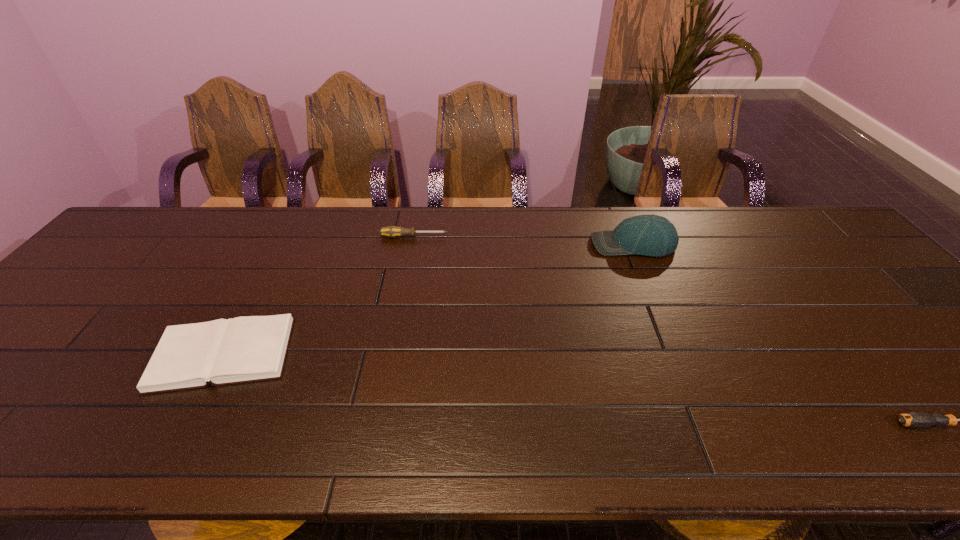
Identify the location of screwdriver that is at the far edge. This screenshot has width=960, height=540. (391, 231).

Identify the location of vacant space at the far edge of the desktop. (601, 225).

In the image, there is a desktop. At what (x,y) coordinates should I click in order to perform the action: click on blank space at the near edge. Please return your answer as a coordinate pair (x, y). This screenshot has width=960, height=540. Looking at the image, I should click on (348, 447).

The height and width of the screenshot is (540, 960). Identify the location of vacant space at the left edge of the desktop. (41, 392).

Image resolution: width=960 pixels, height=540 pixels. Identify the location of free space at the right edge of the desktop. (879, 302).

What are the coordinates of `blank area at the far left corner` in the screenshot? It's located at (172, 210).

Where is `vacant position at the far right corner of the desktop`? vacant position at the far right corner of the desktop is located at coordinates (784, 218).

Locate an element on the screen. free point between the leftmost object and the left screwdriver is located at coordinates (319, 295).

This screenshot has width=960, height=540. I want to click on vacant space that's between the third object from left to right and the taller screwdriver, so click(523, 241).

Identify the location of vacant area that lies between the baseball cap and the hardback book. This screenshot has height=540, width=960. (428, 299).